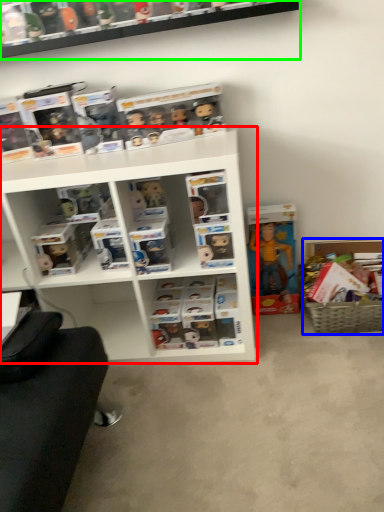
Question: Which is nearer to the shelf (highlighted by a red box)? cabinet (highlighted by a blue box) or shelf (highlighted by a green box).

Choices:
 (A) cabinet
 (B) shelf

Answer: (B)